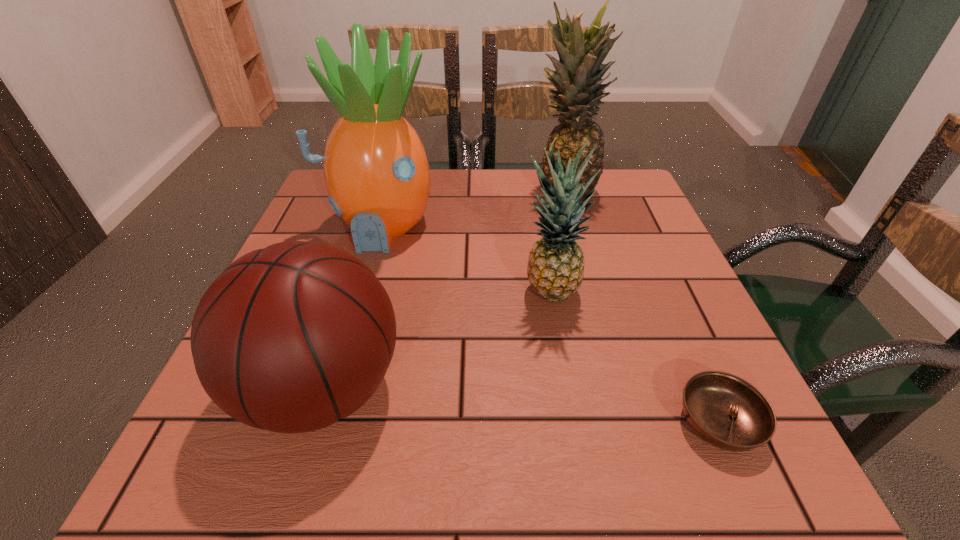
Locate an element on the screen. Image resolution: width=960 pixels, height=540 pixels. the leftmost pineapple is located at coordinates 376,171.

You are a GUI agent. You are given a task and a screenshot of the screen. Output one action in this format:
    pyautogui.click(x=<x>, y=<y>)
    Task: Click on the nearest pineapple
    Image resolution: width=960 pixels, height=540 pixels.
    Given the screenshot: What is the action you would take?
    pyautogui.click(x=555, y=270)

Find the location of a particular element. Image resolution: width=960 pixels, height=540 pixels. the shortest pineapple is located at coordinates (555, 270).

The image size is (960, 540). Identify the location of basketball. (291, 338).

Where is `soup bowl`? This screenshot has width=960, height=540. soup bowl is located at coordinates (726, 411).

What are the coordinates of `vacant point located 0.130m at the entrance of the leftmost pineapple` in the screenshot? It's located at (356, 303).

You are a GUI agent. You are given a task and a screenshot of the screen. Output one action in this format:
    pyautogui.click(x=<x>, y=<y>)
    Task: Click on the vacant space located on the back of the third tallest object
    Image resolution: width=960 pixels, height=540 pixels.
    Given the screenshot: What is the action you would take?
    pyautogui.click(x=542, y=246)

You are a GUI agent. You are given a task and a screenshot of the screen. Output one action in this format:
    pyautogui.click(x=<x>, y=<y>)
    Task: Click on the blank space located on the right of the fourth tallest object
    Image resolution: width=960 pixels, height=540 pixels.
    Given the screenshot: What is the action you would take?
    tap(598, 388)

The width and height of the screenshot is (960, 540). Find the location of `vacant space positioned 0.380m on the back of the soup bowl`. vacant space positioned 0.380m on the back of the soup bowl is located at coordinates (638, 239).

Identify the location of basketball present at the near edge. (291, 338).